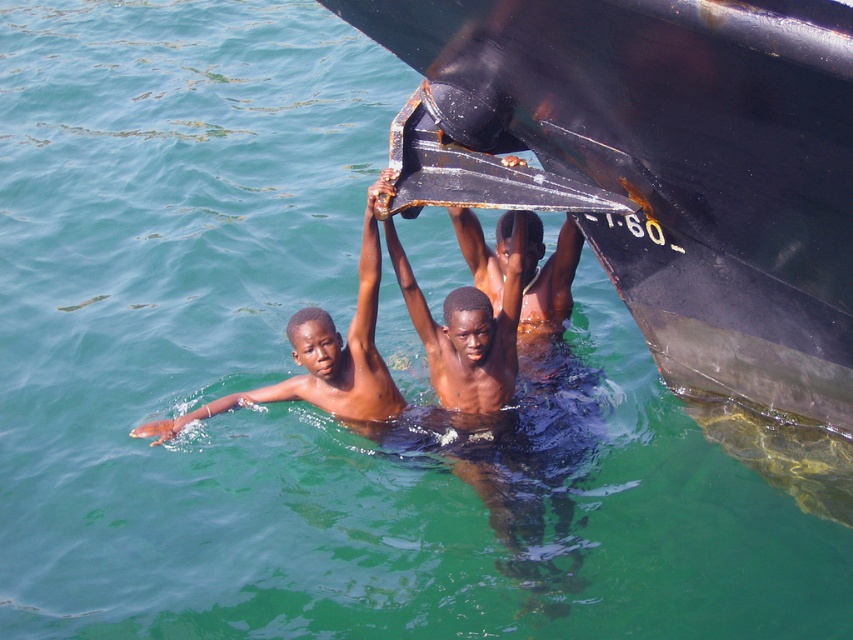
Consider the image. Between rusty metal boat at upper center and smooth skin child at left, which one appears on the right side from the viewer's perspective?

Positioned to the right is rusty metal boat at upper center.

Does point (833, 106) come closer to viewer compared to point (326, 358)?

Yes, point (833, 106) is in front of point (326, 358).

Who is more distant from viewer, (x=733, y=230) or (x=352, y=340)?

Positioned behind is point (x=352, y=340).

Image resolution: width=853 pixels, height=640 pixels. I want to click on rusty metal boat at upper center, so click(659, 164).

Does smooth skin child at left have a lesser width compared to smooth dark wood plank at center?

No.

Between smooth skin child at left and smooth dark wood plank at center, which one is positioned lower?

Positioned lower is smooth skin child at left.

Is point (360, 358) positioned in front of point (494, 324)?

No, (360, 358) is further to viewer.

Find the location of a particular element. This screenshot has height=640, width=853. smooth skin child at left is located at coordinates (325, 353).

Does rusty metal boat at upper center appear on the right side of smooth dark wood plank at center?

Indeed, rusty metal boat at upper center is positioned on the right side of smooth dark wood plank at center.

Based on the photo, can you confirm if rusty metal boat at upper center is taller than smooth dark wood plank at center?

Yes.

Who is more forward, (415, 193) or (450, 387)?

Point (415, 193) is in front.

Find the location of a particular element. rusty metal boat at upper center is located at coordinates (659, 164).